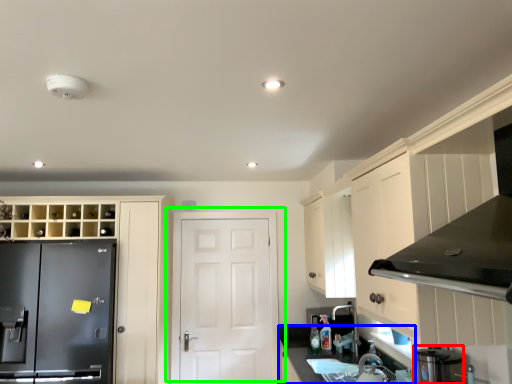
Question: Based on their relative distances, which object is farther from appliance (highlighted by a red box)? Choose from counter top (highlighted by a blue box) and door (highlighted by a green box).

Choices:
 (A) counter top
 (B) door

Answer: (B)